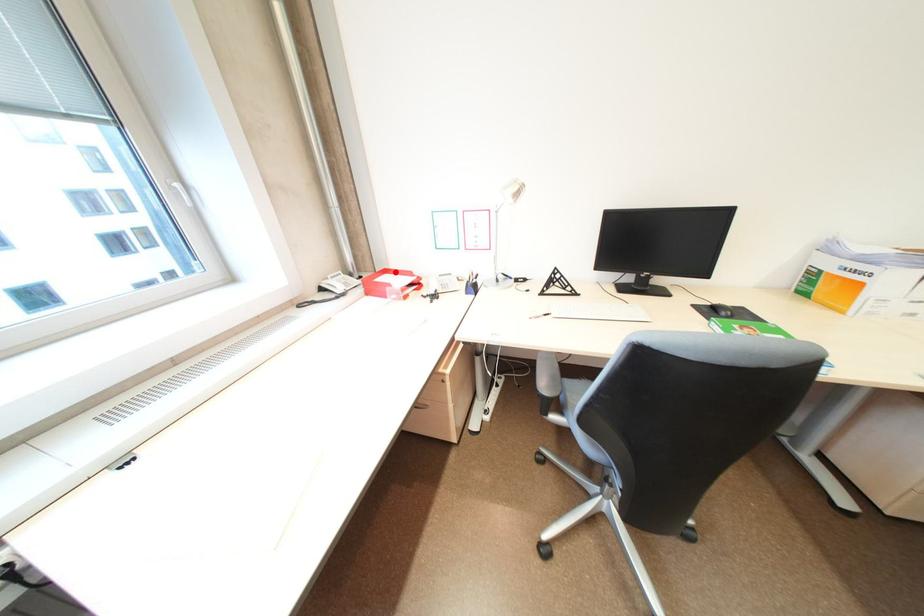
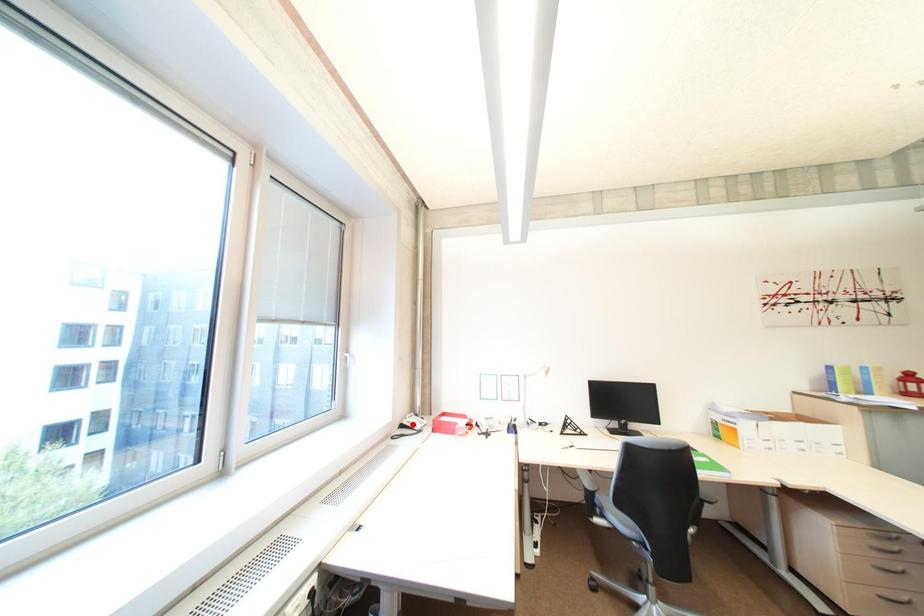
I am providing you with two images of the same scene from different viewpoints. A red point is marked on the first image and another point is marked on the second image. Is the marked point in image1 the same physical position as the marked point in image2?

No